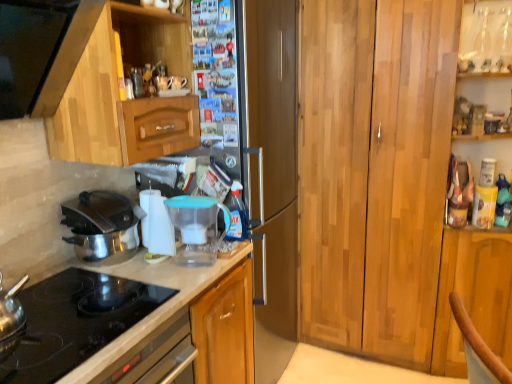
At what (x,y) coordinates should I click in order to perform the action: click on vacant area that lies in front of transparent plastic water filter pitcher at center, the 1th appliance viewed from the right. Please return your answer as a coordinate pair (x, y). Looking at the image, I should click on (186, 280).